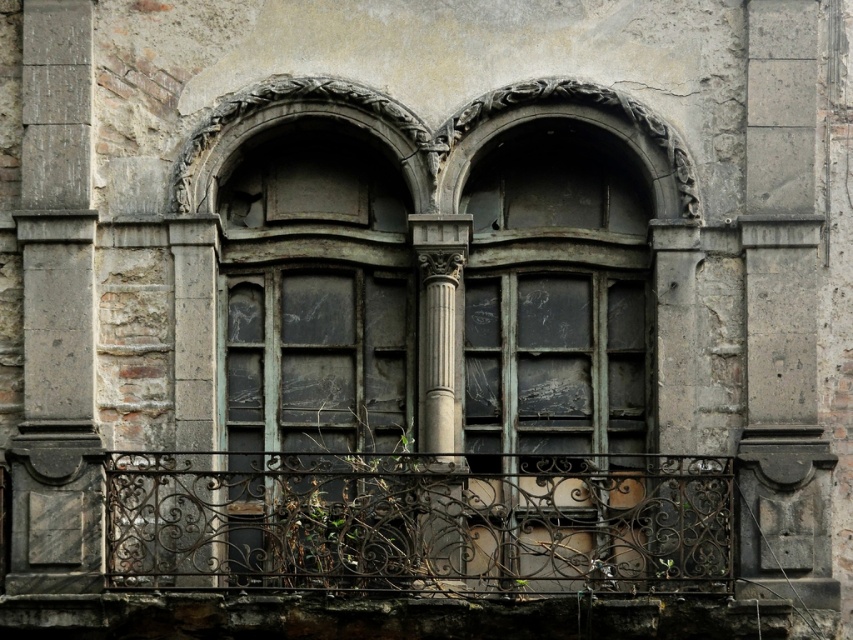
Looking at this image, which is above, rusty wrought iron railing at center or gray stone column at center?

gray stone column at center is higher up.

Does rusty wrought iron railing at center come behind gray stone column at center?

No, rusty wrought iron railing at center is in front of gray stone column at center.

Where is `rusty wrought iron railing at center`? rusty wrought iron railing at center is located at coordinates (419, 522).

The image size is (853, 640). I want to click on rusty wrought iron railing at center, so click(x=419, y=522).

Who is more forward, [357,531] or [26,172]?

Point [357,531] is more forward.

Where is `rusty wrought iron railing at center`? rusty wrought iron railing at center is located at coordinates (419, 522).

Which is more to the right, gray stone column at left or gray stone column at center?

gray stone column at center

Where is `gray stone column at left`? The width and height of the screenshot is (853, 640). gray stone column at left is located at coordinates 56,314.

At what (x,y) coordinates should I click in order to perform the action: click on gray stone column at left. Please return your answer as a coordinate pair (x, y). The image size is (853, 640). Looking at the image, I should click on (56, 314).